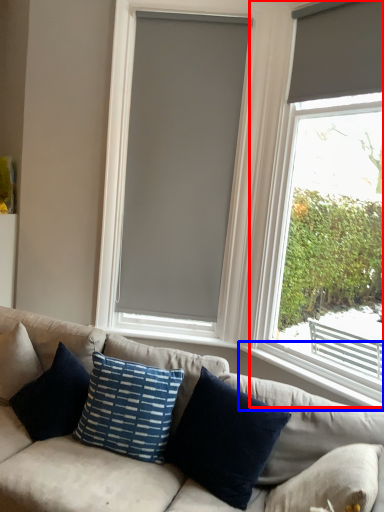
Question: Among these objects, which one is farthest to the camera, window (highlighted by a red box) or window sill (highlighted by a blue box)?

Choices:
 (A) window
 (B) window sill

Answer: (B)